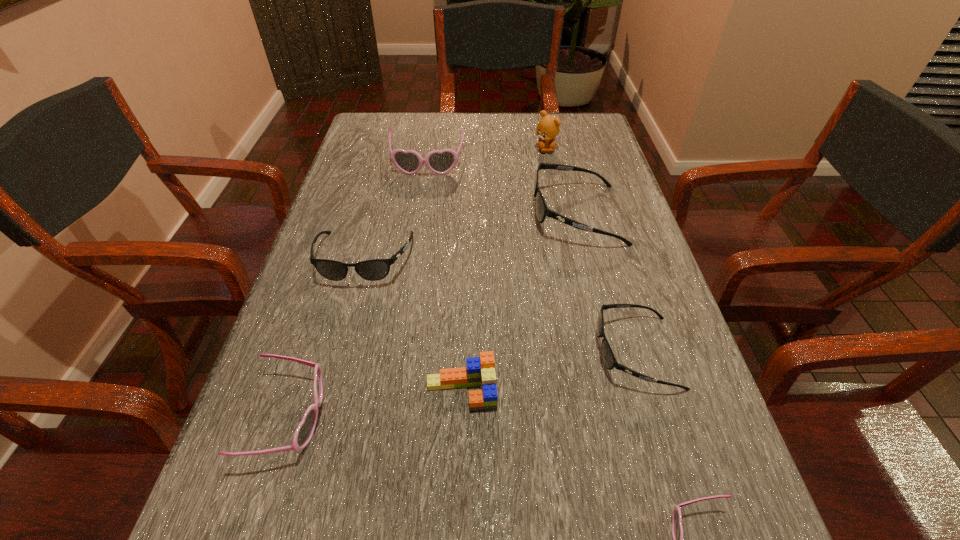
This screenshot has height=540, width=960. I want to click on free area in between the leftmost gray sunglasses and the orange Lego, so click(x=413, y=326).

In order to click on free space between the biggest gray sunglasses and the second smallest pink sunglasses in this screenshot , I will do `click(433, 316)`.

At what (x,y) coordinates should I click in order to perform the action: click on empty space that is in between the smallest gray sunglasses and the Lego. Please return your answer as a coordinate pair (x, y). This screenshot has width=960, height=540. Looking at the image, I should click on (549, 372).

This screenshot has width=960, height=540. Identify the location of vacant region between the second biggest pink sunglasses and the leftmost gray sunglasses. (327, 338).

The width and height of the screenshot is (960, 540). In order to click on empty space that is in between the teddy bear and the leftmost gray sunglasses in this screenshot , I will do `click(455, 204)`.

Locate an element on the screen. The height and width of the screenshot is (540, 960). vacant space that's between the biggest gray sunglasses and the farthest pink sunglasses is located at coordinates (502, 189).

The width and height of the screenshot is (960, 540). In order to click on object that is the fifth closest one to the teddy bear in this screenshot , I will do `click(480, 371)`.

Select which object appears as the closest to the second biggest gray sunglasses. Please provide its 2D coordinates. Your answer should be formatted as a tuple, i.e. [(x, y)], where the tuple contains the x and y coordinates of a point satisfying the conditions above.

[(304, 432)]

You are a GUI agent. You are given a task and a screenshot of the screen. Output one action in this format:
    pyautogui.click(x=<x>, y=<y>)
    Task: Click on the sixth closest sunglasses to the orange Lego
    The height and width of the screenshot is (540, 960).
    Given the screenshot: What is the action you would take?
    pyautogui.click(x=410, y=162)

Point out which sunglasses is positioned as the nearest to the leftmost gray sunglasses. Please provide its 2D coordinates. Your answer should be formatted as a tuple, i.e. [(x, y)], where the tuple contains the x and y coordinates of a point satisfying the conditions above.

[(304, 432)]